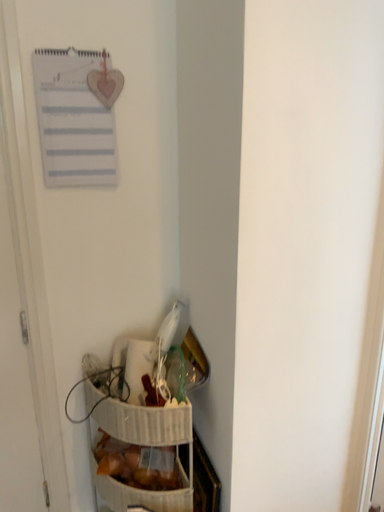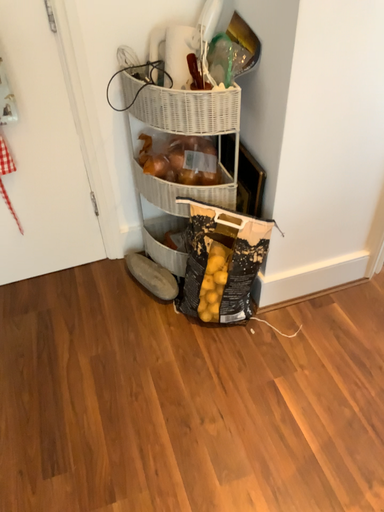
Question: Which way did the camera rotate in the video?

Choices:
 (A) rotated upward
 (B) rotated downward

Answer: (B)